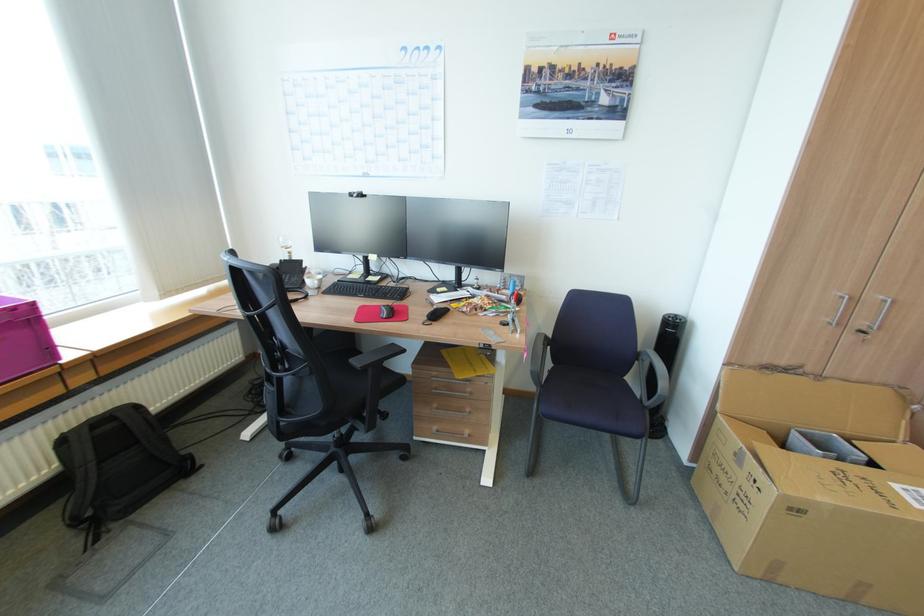
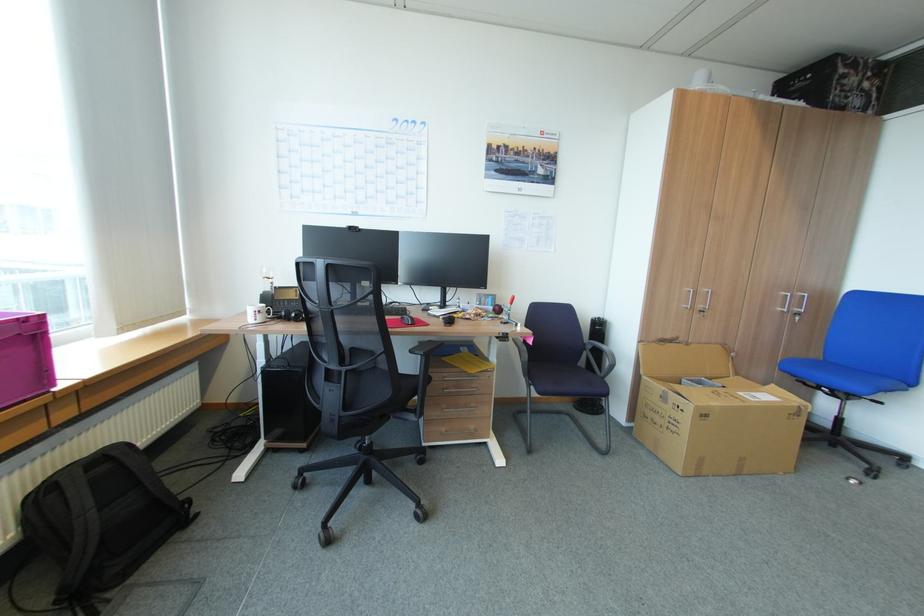
Question: In a continuous first-person perspective shot, in which direction is the camera moving?

Choices:
 (A) Left
 (B) Right
 (C) Forward
 (D) Backward

Answer: (A)